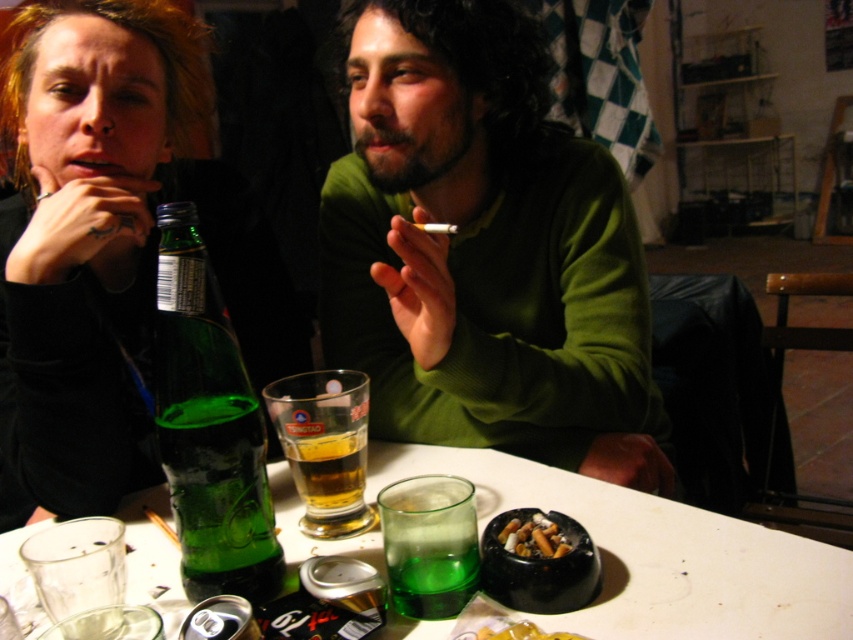
Question: Which point is closer to the camera?

Choices:
 (A) transparent glass ashtray at center
 (B) green glass bottle at center

Answer: (A)

Question: Is green matte sweater at center smaller than transparent glass ashtray at center?

Choices:
 (A) yes
 (B) no

Answer: (B)

Question: Is black matte bottle at left smaller than charcoal ashtray at table center?

Choices:
 (A) no
 (B) yes

Answer: (A)

Question: Is black matte bottle at left to the right of transparent glass ashtray at center from the viewer's perspective?

Choices:
 (A) yes
 (B) no

Answer: (B)

Question: Which object appears closest to the camera in this image?

Choices:
 (A) charcoal ashtray at table center
 (B) transparent glass ashtray at center
 (C) green matte sweater at center

Answer: (B)

Question: Which object is farther from the camera taking this photo?

Choices:
 (A) green glass bottle at center
 (B) black matte bottle at left
 (C) green matte sweater at center
 (D) charcoal ashtray at table center

Answer: (B)